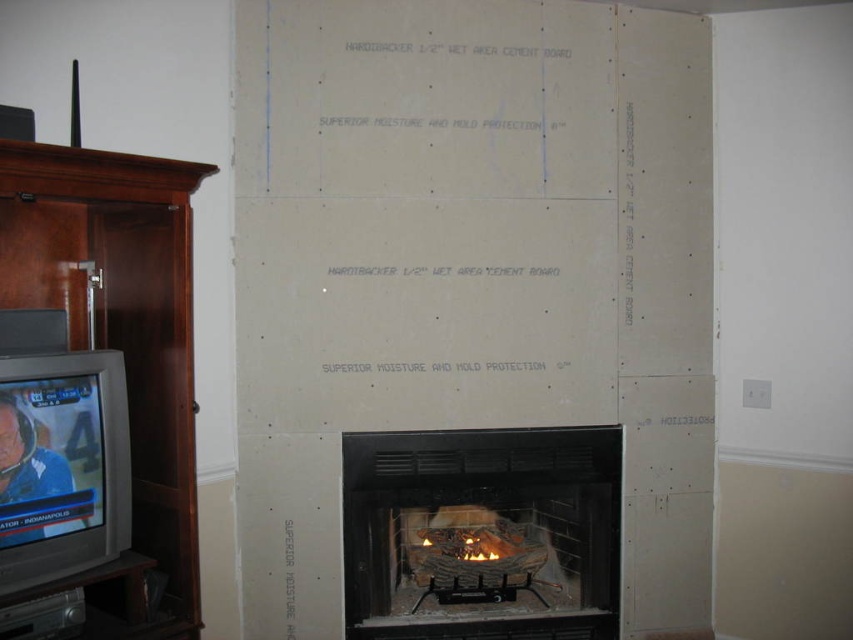
Can you confirm if matte black fireplace at center is wider than matte gray television at left?

Correct, the width of matte black fireplace at center exceeds that of matte gray television at left.

How much distance is there between matte black fireplace at center and matte gray television at left?

matte black fireplace at center and matte gray television at left are 4.02 feet apart.

Who is more forward, (502,600) or (68,371)?

Point (68,371) is in front.

Find the location of a particular element. This screenshot has width=853, height=640. matte black fireplace at center is located at coordinates (480, 532).

Is matte black fireplace at center further to camera compared to dark wood entertainment center at left?

Yes, it is behind dark wood entertainment center at left.

Is matte black fireplace at center above dark wood entertainment center at left?

Incorrect, matte black fireplace at center is not positioned above dark wood entertainment center at left.

This screenshot has width=853, height=640. Describe the element at coordinates (480, 532) in the screenshot. I see `matte black fireplace at center` at that location.

Image resolution: width=853 pixels, height=640 pixels. In order to click on matte black fireplace at center in this screenshot , I will do `click(480, 532)`.

Which is above, dark wood entertainment center at left or matte gray television at left?

dark wood entertainment center at left

Which is in front, point (149, 308) or point (38, 480)?

Positioned in front is point (38, 480).

The image size is (853, 640). I want to click on dark wood entertainment center at left, so click(120, 342).